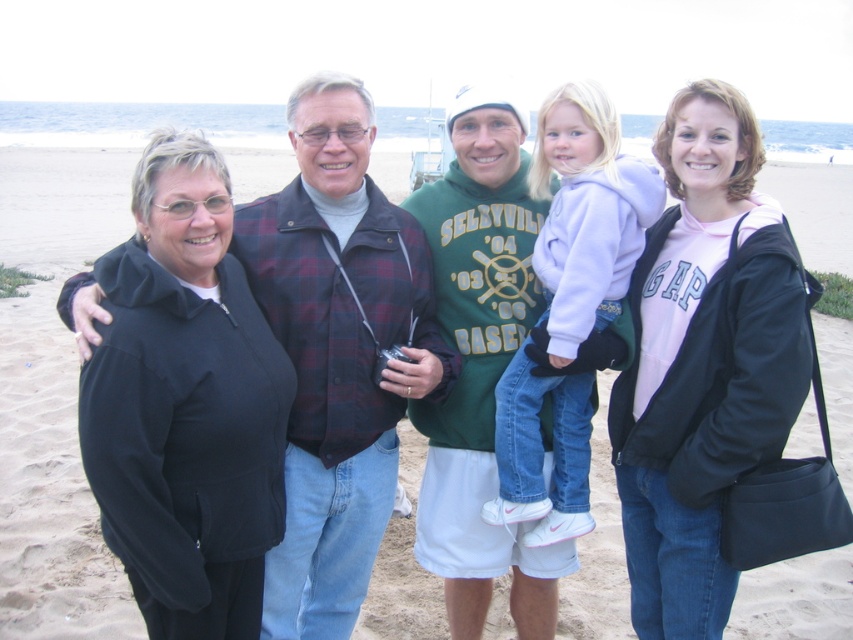
Question: Does black fleece jacket at left have a smaller size compared to black fabric jacket at center?

Choices:
 (A) no
 (B) yes

Answer: (B)

Question: Which point is closer to the camera taking this photo?

Choices:
 (A) (167, 134)
 (B) (619, 380)

Answer: (A)

Question: Is black fleece jacket at left above black fabric jacket at center?

Choices:
 (A) no
 (B) yes

Answer: (A)

Question: Among these objects, which one is farthest from the camera?

Choices:
 (A) black fabric jacket at center
 (B) black fleece jacket at left

Answer: (A)

Question: Does black fleece jacket at left have a lesser width compared to black fabric jacket at center?

Choices:
 (A) no
 (B) yes

Answer: (A)